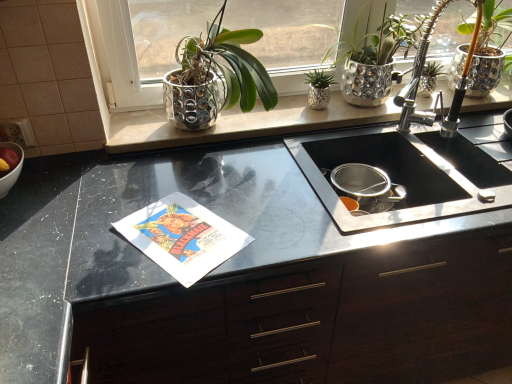
This screenshot has height=384, width=512. Identify the location of free space that is to the left of green metallic pot at upper center, marked as the second houseplant in a right-to-left arrangement. (281, 116).